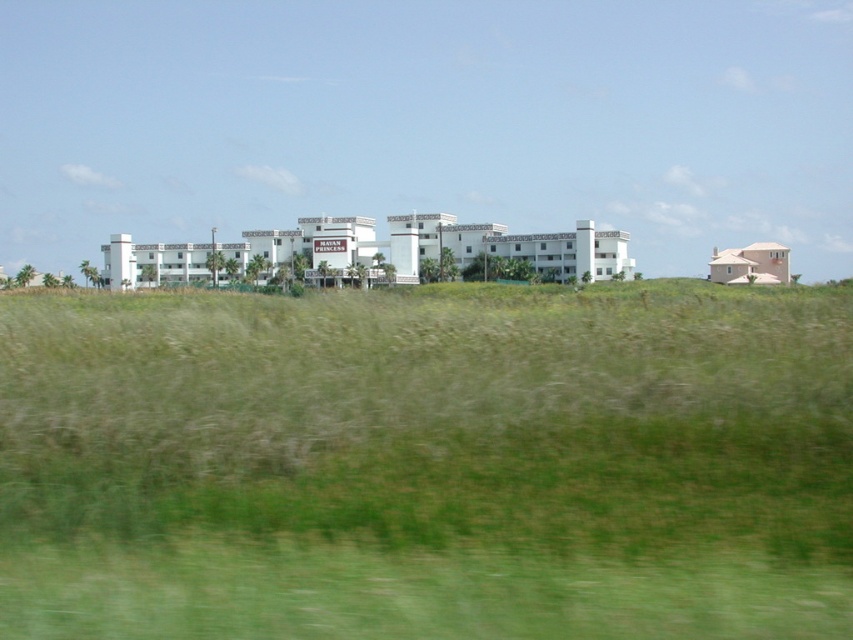
Question: Is green grassy field at center positioned before white matte building at center?

Choices:
 (A) no
 (B) yes

Answer: (B)

Question: Among these objects, which one is farthest from the camera?

Choices:
 (A) pink stucco house at right
 (B) white matte building at center
 (C) green grassy field at center

Answer: (A)

Question: Considering the relative positions of green grassy field at center and white matte building at center in the image provided, where is green grassy field at center located with respect to white matte building at center?

Choices:
 (A) above
 (B) below

Answer: (B)

Question: Among these objects, which one is farthest from the camera?

Choices:
 (A) green grassy field at center
 (B) white matte building at center
 (C) pink stucco house at right

Answer: (C)

Question: Is the position of green grassy field at center less distant than that of pink stucco house at right?

Choices:
 (A) no
 (B) yes

Answer: (B)

Question: Which point is farther to the camera?

Choices:
 (A) (16, 468)
 (B) (741, 253)
 (C) (434, 241)

Answer: (B)